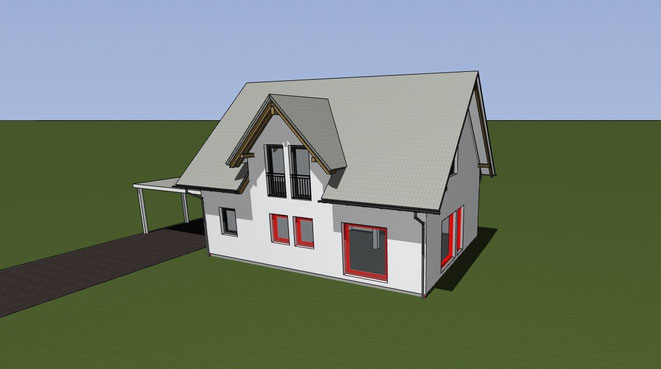
At what (x,y) coordinates should I click in order to perform the action: click on pillar. Please return your answer as a coordinate pair (x, y). This screenshot has height=369, width=661. Looking at the image, I should click on (375, 238).